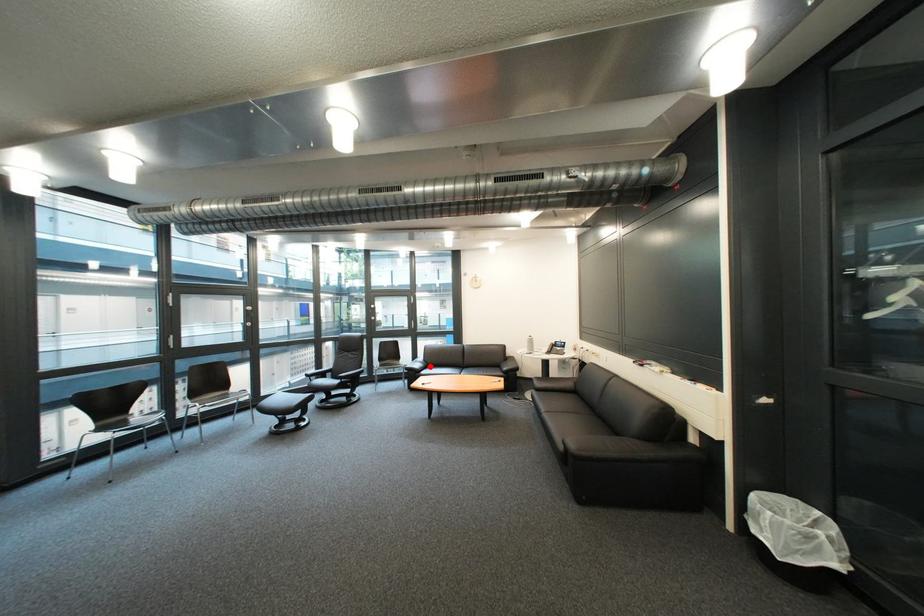
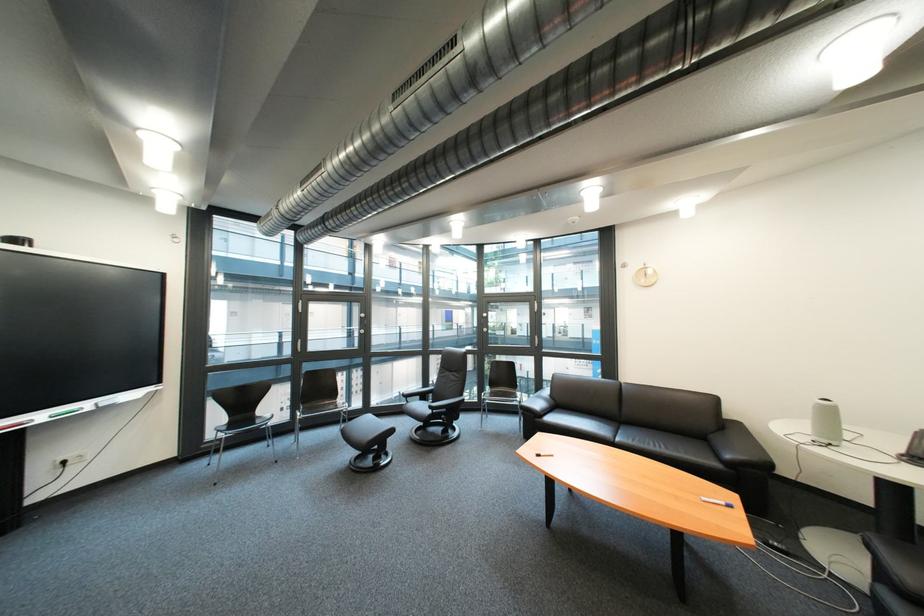
Locate, in the second image, the point that corresponds to the highlighted location in the first image.

(551, 406)